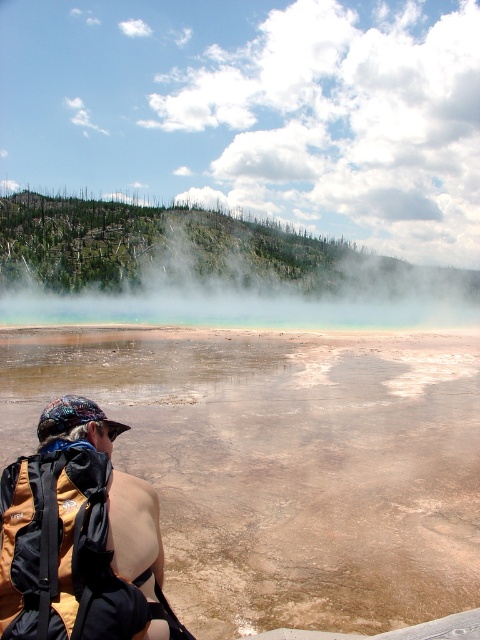
Question: Does brown sedimentary water at center appear under white misty steam at upper center?

Choices:
 (A) yes
 (B) no

Answer: (A)

Question: Among these objects, which one is nearest to the camera?

Choices:
 (A) brown sedimentary water at center
 (B) brown fabric backpack at lower left
 (C) white misty steam at upper center

Answer: (B)

Question: Which object is farther from the camera taking this photo?

Choices:
 (A) brown sedimentary water at center
 (B) white misty steam at upper center
 (C) brown fabric backpack at lower left

Answer: (B)

Question: Considering the relative positions of brown sedimentary water at center and white misty steam at upper center in the image provided, where is brown sedimentary water at center located with respect to white misty steam at upper center?

Choices:
 (A) left
 (B) right

Answer: (A)

Question: Does white misty steam at upper center lie behind brown fabric backpack at lower left?

Choices:
 (A) no
 (B) yes

Answer: (B)

Question: Which point is farther from the camera taking this photo?

Choices:
 (A) (458, 273)
 (B) (139, 387)

Answer: (A)